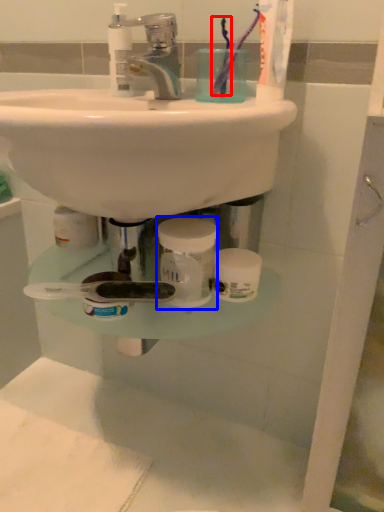
Question: Which point is further to the camera, toothbrush (highlighted by a red box) or mouthwash (highlighted by a blue box)?

Choices:
 (A) toothbrush
 (B) mouthwash

Answer: (A)